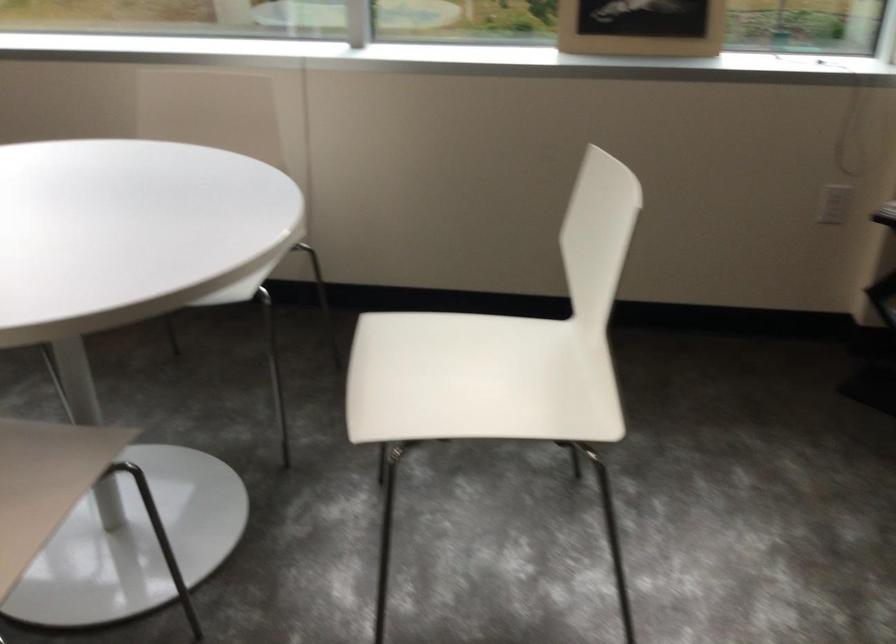
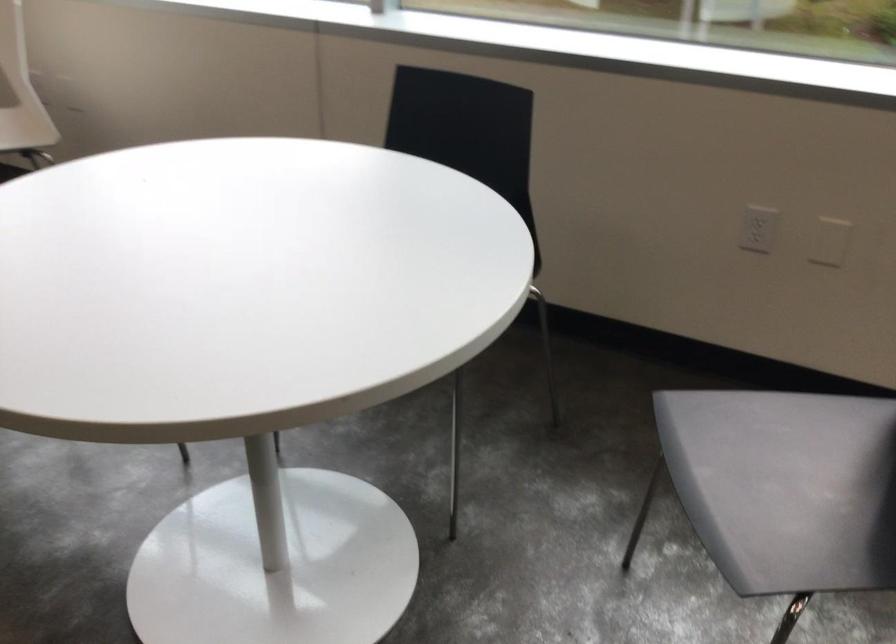
Question: In a continuous first-person perspective shot, in which direction is the camera moving?

Choices:
 (A) Left
 (B) Right
 (C) Forward
 (D) Backward

Answer: (A)